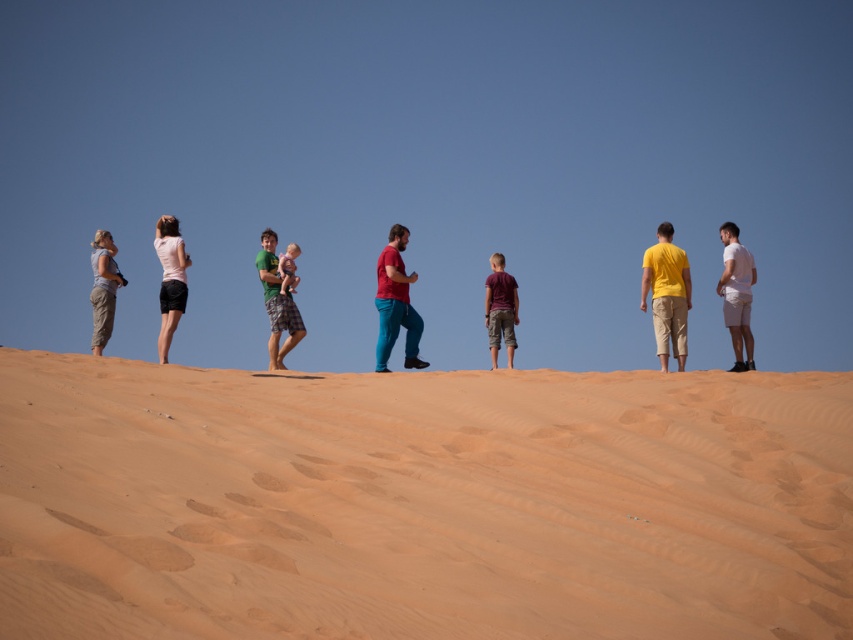
Question: Does matte red pants at center have a smaller size compared to green plaid shorts at center?

Choices:
 (A) no
 (B) yes

Answer: (B)

Question: Which object is farther from the camera taking this photo?

Choices:
 (A) matte khaki pants at left
 (B) green plaid shorts at center

Answer: (A)

Question: Observing the image, what is the correct spatial positioning of smooth sand at upper center in reference to matte red pants at center?

Choices:
 (A) above
 (B) below

Answer: (B)

Question: Can you confirm if green plaid shorts at center is bigger than matte green shirt at center?

Choices:
 (A) yes
 (B) no

Answer: (A)

Question: Among these objects, which one is nearest to the camera?

Choices:
 (A) smooth sand at upper center
 (B) green plaid shorts at center

Answer: (A)

Question: Which point is farther to the camera?

Choices:
 (A) (515, 291)
 (B) (636, 472)

Answer: (A)